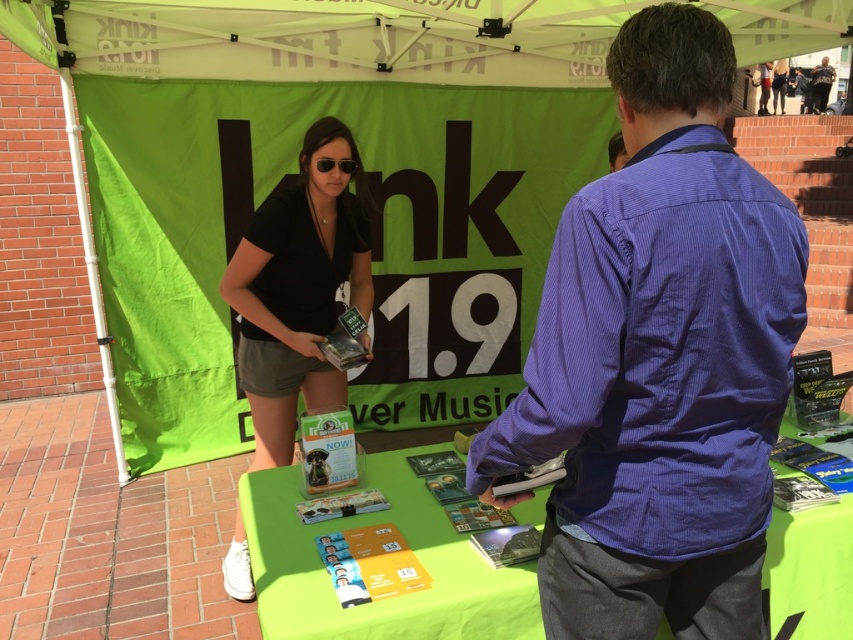
Question: Is green fabric canopy at upper center wider than green fabric table at center?

Choices:
 (A) yes
 (B) no

Answer: (A)

Question: Which of the following is the closest to the observer?

Choices:
 (A) (341, 166)
 (B) (265, 216)
 (C) (291, 522)

Answer: (C)

Question: Is green fabric canopy at upper center thinner than black plastic sunglasses at upper center?

Choices:
 (A) no
 (B) yes

Answer: (A)

Question: Which object is the closest to the green fabric canopy at upper center?

Choices:
 (A) black matte shirt at center
 (B) purple shirt at center
 (C) black plastic sunglasses at upper center

Answer: (A)

Question: Can you confirm if purple shirt at center is thinner than green fabric table at center?

Choices:
 (A) yes
 (B) no

Answer: (A)

Question: Among these points, which one is nearest to the camera?

Choices:
 (A) (361, 294)
 (B) (84, 13)

Answer: (A)